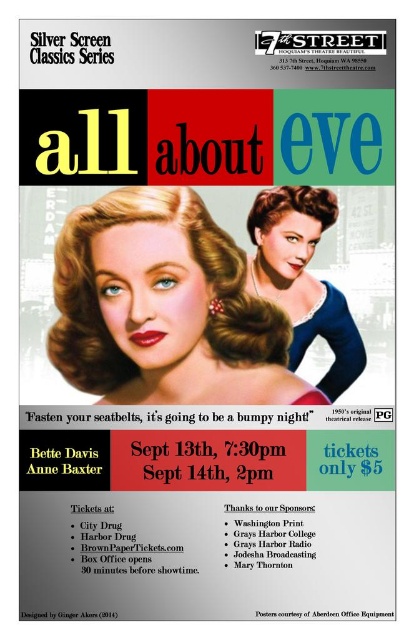
You are an actor in a play and you need to choose between wearing the matte blonde hair at center or the blue satin dress at center for your costume. Based on their sizes, which one would you pick if you want the larger item?

The matte blonde hair at center is bigger than the blue satin dress at center, so you should choose the matte blonde hair at center if you want the larger item.

You are designing a layout for a promotional poster and need to ensure that the elements at the center are balanced. Given that the matte blonde hair at center and the blue satin dress at center are both central elements, which one should you adjust to make the design more balanced if you want to maintain their central positions?

The matte blonde hair at center is wider than the blue satin dress at center. To balance the design while keeping them centered, you should adjust the blue satin dress at center to be wider or reduce the width of the matte blonde hair at center.